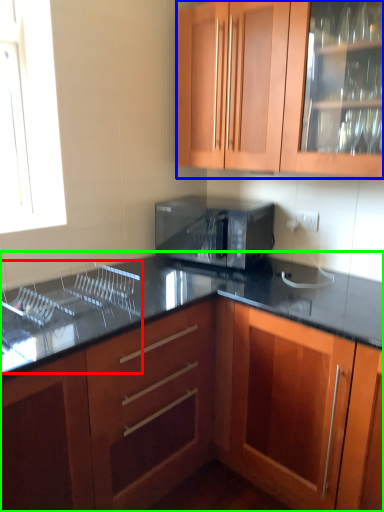
Question: Which object is positioned farthest from sink (highlighted by a red box)? Select from cabinetry (highlighted by a blue box) and cabinetry (highlighted by a green box).

Choices:
 (A) cabinetry
 (B) cabinetry

Answer: (A)